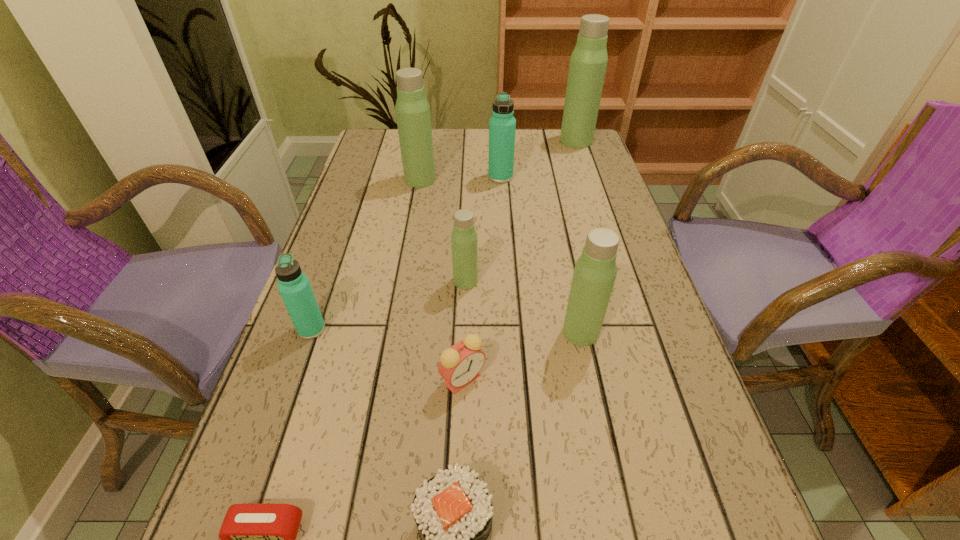
Identify the location of the nearer aqua thermos bottle. The height and width of the screenshot is (540, 960). (295, 289).

The width and height of the screenshot is (960, 540). Find the location of `the leftmost thermos bottle`. the leftmost thermos bottle is located at coordinates (295, 289).

Find the location of a particular element. The height and width of the screenshot is (540, 960). the right pink alarm clock is located at coordinates (459, 365).

Locate an element on the screen. The image size is (960, 540). the right alarm clock is located at coordinates (459, 365).

Image resolution: width=960 pixels, height=540 pixels. In order to click on vacant space located 0.050m on the left of the rightmost object in this screenshot , I will do `click(544, 140)`.

Identify the location of vacant space located on the right of the seventh object from right to left. The width and height of the screenshot is (960, 540). (568, 180).

At what (x,y) coordinates should I click in order to perform the action: click on blank space located on the left of the bigger aqua thermos bottle. Please return your answer as a coordinate pair (x, y). The height and width of the screenshot is (540, 960). Looking at the image, I should click on [x=364, y=177].

Identify the location of vacant area situated 0.160m on the back of the fifth thermos bottle from left to right. (566, 265).

The width and height of the screenshot is (960, 540). Find the location of `vacant space located on the front of the second light thermos bottle from left to right`. vacant space located on the front of the second light thermos bottle from left to right is located at coordinates (464, 334).

Locate an element on the screen. The width and height of the screenshot is (960, 540). vacant area situated 0.230m on the right of the nearer aqua thermos bottle is located at coordinates (442, 329).